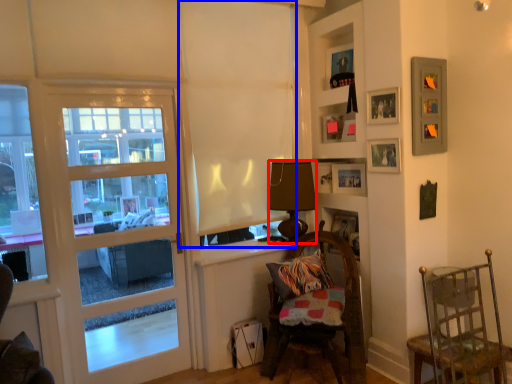
Question: Which object appears closest to the camera in this image, lamp (highlighted by a red box) or curtain (highlighted by a blue box)?

Choices:
 (A) lamp
 (B) curtain

Answer: (B)